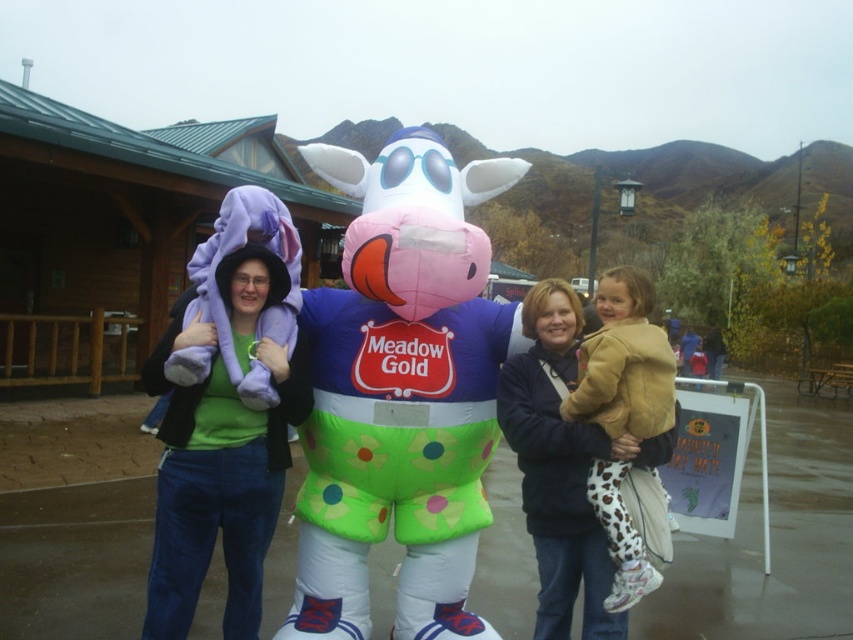
You are trying to find the matte purple towel at left in the image. Based on the coordinates provided in the Objects Description, where would you look first?

The matte purple towel at left is located at point (401, 392), so you should look at that coordinate first.

You are a photographer trying to focus on the person wearing the matte black jacket at center and the light brown leather jacket at center. Which jacket is positioned lower in the photo?

The matte black jacket at center is positioned lower than the light brown leather jacket at center in the photo.